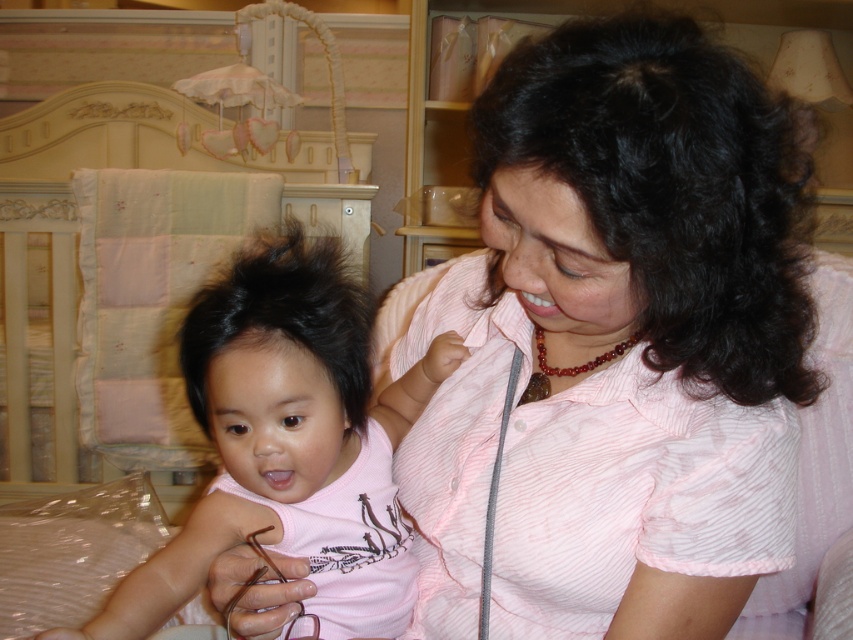
Describe the element at coordinates (619, 342) in the screenshot. I see `pink striped shirt at center` at that location.

Does point (628, 147) lie in front of point (350, 552)?

That is True.

This screenshot has width=853, height=640. I want to click on pink striped shirt at center, so click(x=619, y=342).